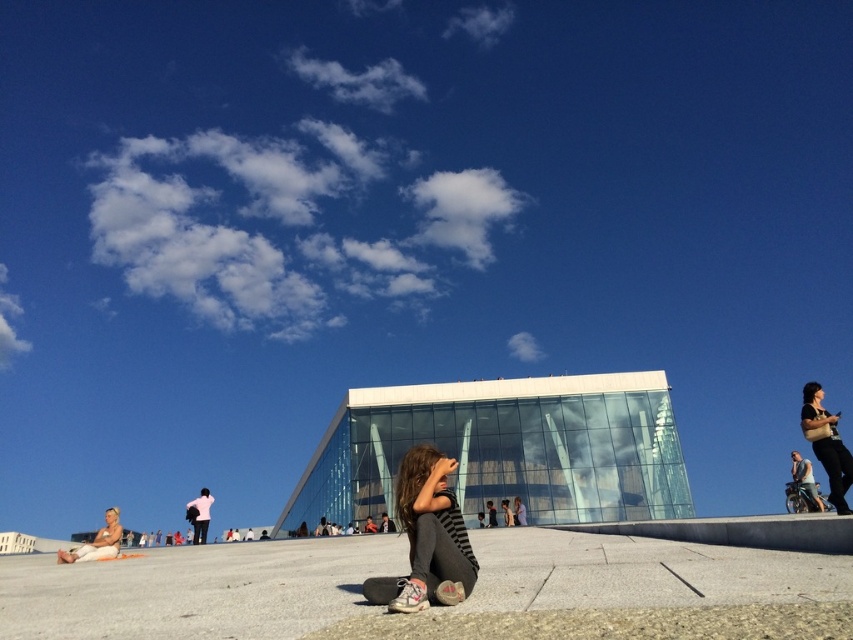
Is gray concrete at center bigger than white matte shirt at upper center?

Yes, gray concrete at center is bigger than white matte shirt at upper center.

Between point (212, 614) and point (202, 492), which one is positioned behind?

Positioned behind is point (202, 492).

Who is more distant from viewer, (x=245, y=580) or (x=195, y=536)?

Point (x=195, y=536)

Find the location of a particular element. gray concrete at center is located at coordinates (196, 589).

Is the position of striped fabric girl at center less distant than that of white matte shirt at upper center?

Yes, striped fabric girl at center is closer to the viewer.

Does striped fabric girl at center appear over white matte shirt at upper center?

Yes.

Between point (418, 566) and point (196, 515), which one is positioned behind?

The point (196, 515) is more distant.

Find the location of `striped fabric girl at center`. striped fabric girl at center is located at coordinates (x=427, y=538).

How far apart are light brown leather jacket at lower left and white matte shirt at upper center?

light brown leather jacket at lower left is 10.56 meters away from white matte shirt at upper center.

Which is above, light brown leather jacket at lower left or white matte shirt at upper center?

Positioned higher is white matte shirt at upper center.

The height and width of the screenshot is (640, 853). In order to click on light brown leather jacket at lower left in this screenshot , I will do `click(97, 541)`.